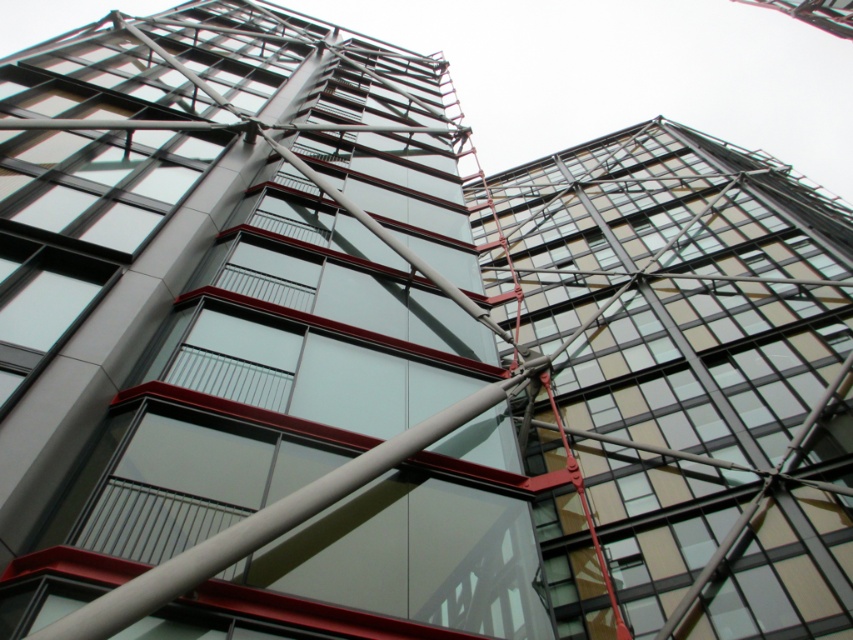
You are standing at the base of the glassy steel tower at center. Looking up, you notice a point marked at coordinates [247,333]. What is located at this point?

The point at coordinates [247,333] is where the glassy steel tower at center is located.

Looking at this image, you are standing at the base of the glassy steel tower at center and want to look at the transparent glass building at upper right. In which direction should you turn your head to see it?

You should turn your head to the right to see the transparent glass building at upper right because the glassy steel tower at center is to the left of it.

You are an architect evaluating the structural integrity of the building. Which object, the glassy steel tower at center or the transparent glass building at upper right, might require a different approach in terms of load distribution due to its width?

The glassy steel tower at center has a lesser width compared to transparent glass building at upper right, so it might require a different approach in terms of load distribution due to its narrower base.